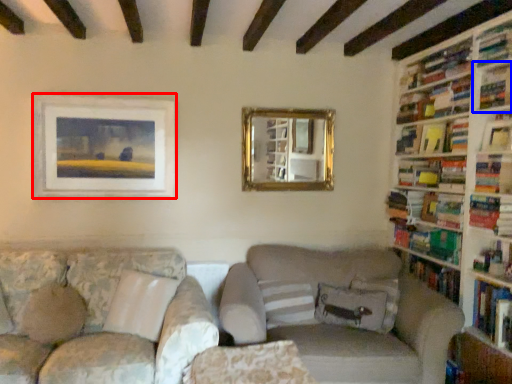
Question: Among these objects, which one is nearest to the camera, picture frame (highlighted by a red box) or shelf (highlighted by a blue box)?

Choices:
 (A) picture frame
 (B) shelf

Answer: (B)